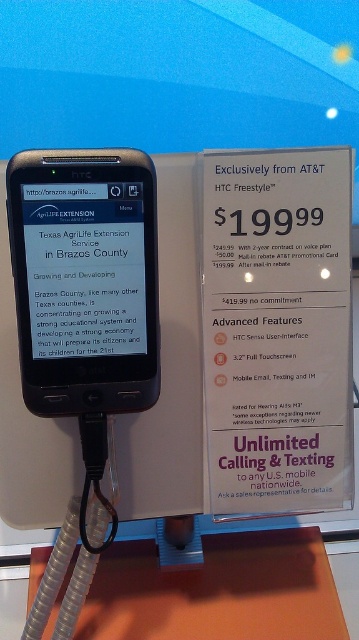
Question: Does matte black phone at center have a lesser width compared to orange matte table at lower center?

Choices:
 (A) no
 (B) yes

Answer: (B)

Question: Can you confirm if matte black phone at center is positioned below orange matte table at lower center?

Choices:
 (A) yes
 (B) no

Answer: (B)

Question: Which of the following is the closest to the observer?

Choices:
 (A) matte black phone at center
 (B) orange matte table at lower center

Answer: (A)

Question: Can you confirm if matte black phone at center is positioned to the right of orange matte table at lower center?

Choices:
 (A) yes
 (B) no

Answer: (B)

Question: Which point appears farthest from the camera in this image?

Choices:
 (A) (334, 588)
 (B) (59, 211)

Answer: (A)